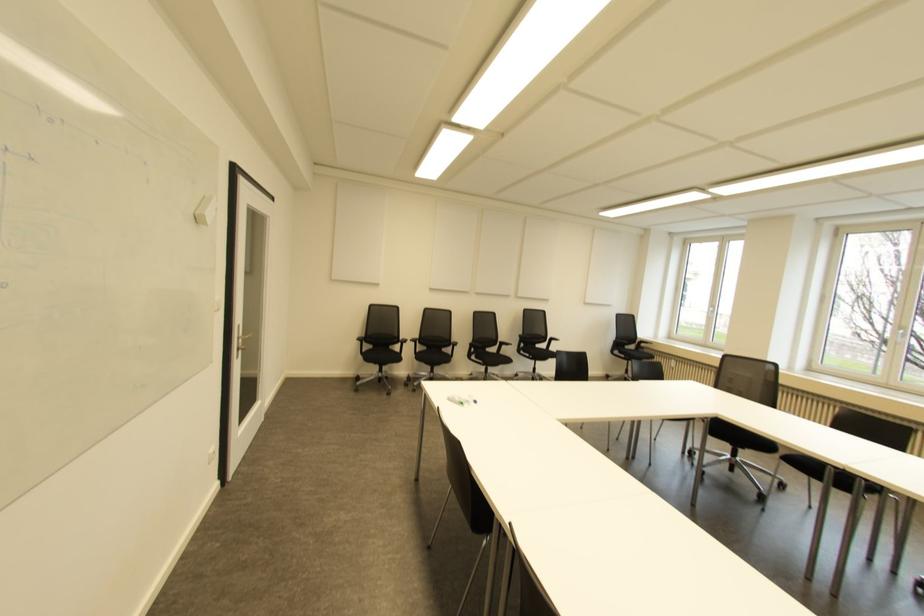
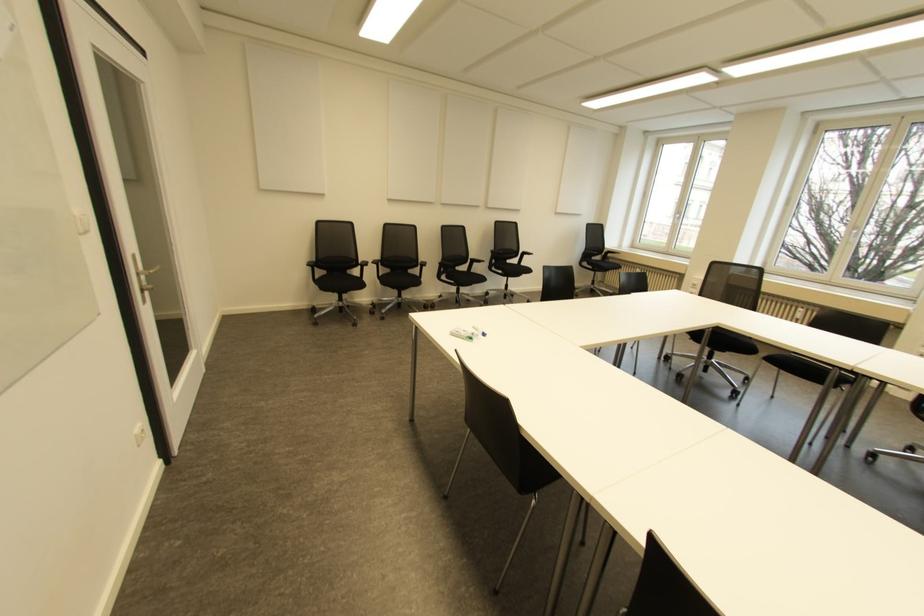
Question: The images are taken continuously from a first-person perspective. In which direction is your viewpoint rotating?

Choices:
 (A) Left
 (B) Right
 (C) Up
 (D) Down

Answer: (D)